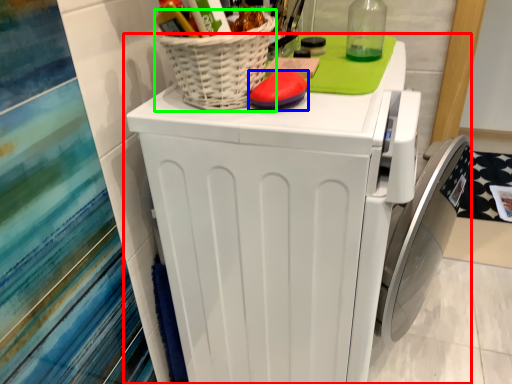
Question: Which object is positioned closest to home appliance (highlighted by a red box)? Select from soap (highlighted by a blue box) and basket (highlighted by a green box).

Choices:
 (A) soap
 (B) basket

Answer: (B)